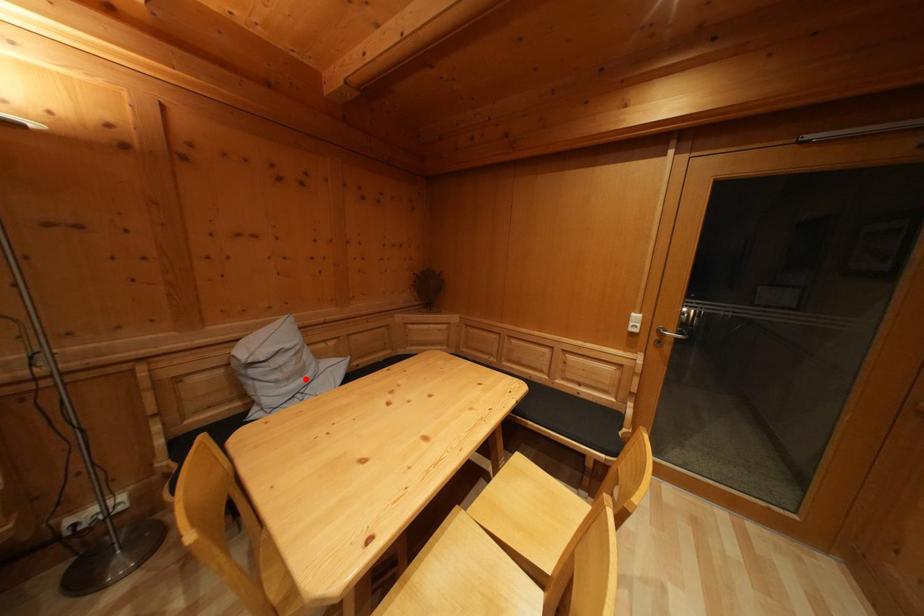
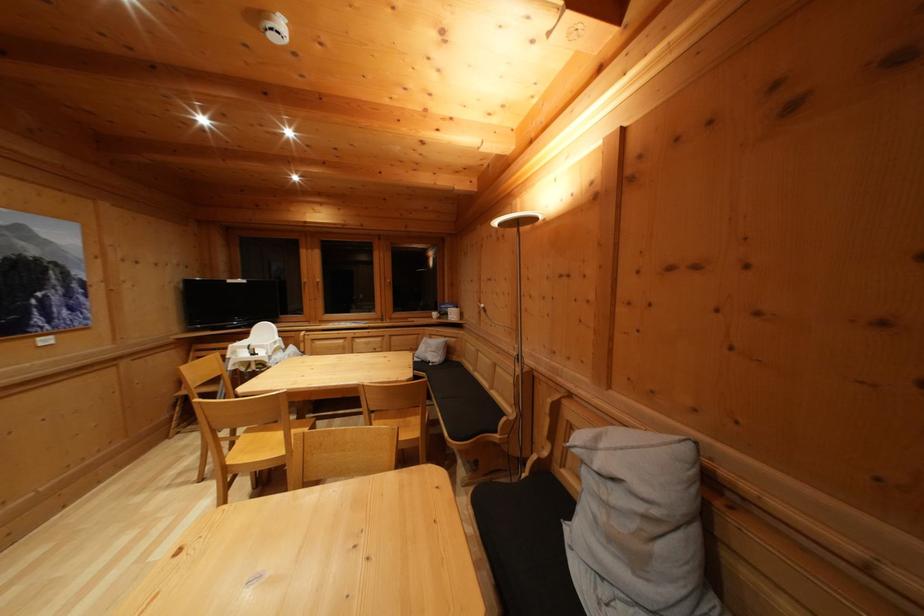
Where in the second image is the point corresponding to the highlighted location from the first image?

(640, 565)